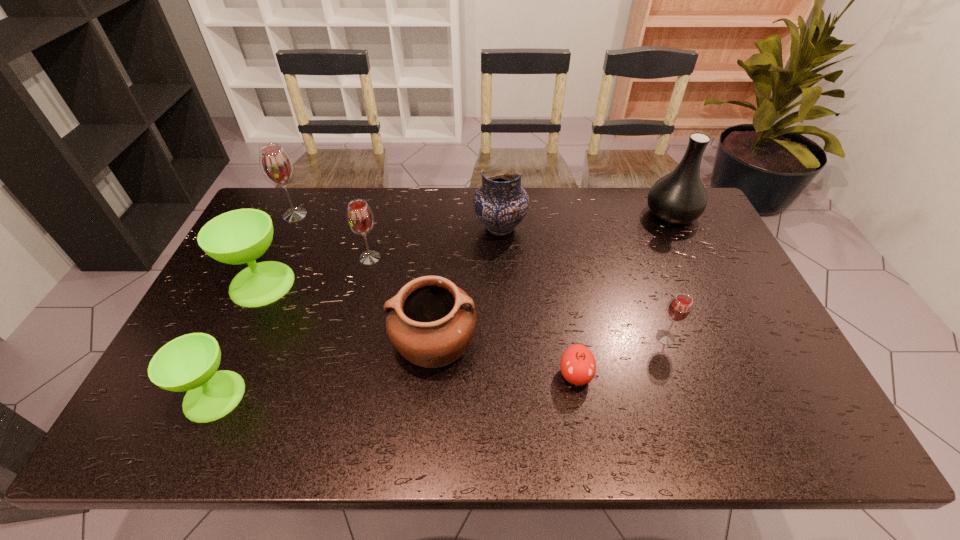
Identify the location of vacant space located on the back of the bigger green wineglass. (300, 203).

Locate an element on the screen. vacant point located 0.260m on the left of the shorter pottery is located at coordinates (292, 342).

This screenshot has width=960, height=540. Identify the location of vacant region located on the right of the rightmost red wineglass. (731, 338).

Where is `blank space located on the back of the nearest wineglass`? The image size is (960, 540). blank space located on the back of the nearest wineglass is located at coordinates (269, 277).

Identify the location of vacant space located 0.290m on the right of the shortest object. This screenshot has width=960, height=540. coord(711,375).

This screenshot has width=960, height=540. What are the coordinates of `vase that is positioned at the far edge` in the screenshot? It's located at 679,197.

Find the location of `wineglass present at the far edge`. wineglass present at the far edge is located at coordinates (276, 165).

At what (x,y) coordinates should I click in order to perform the action: click on pottery at the far edge. Please return your answer as a coordinate pair (x, y). Looking at the image, I should click on (501, 203).

Image resolution: width=960 pixels, height=540 pixels. Identify the location of object located at the near edge. (189, 363).

Where is `object that is at the right edge`? object that is at the right edge is located at coordinates (679, 197).